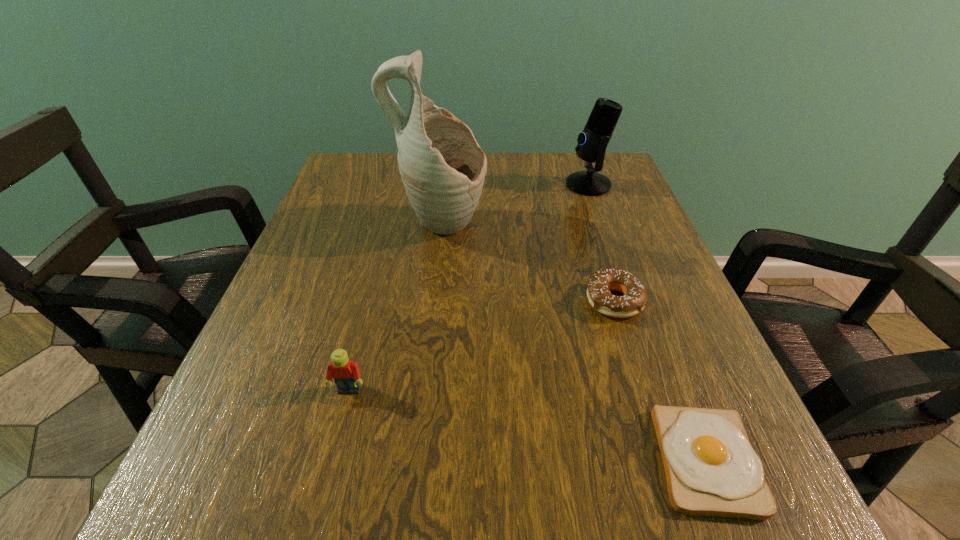
Where is `vacant area situated at the spout of the pitcher`? The height and width of the screenshot is (540, 960). vacant area situated at the spout of the pitcher is located at coordinates (626, 227).

Find the location of a particular element. The image size is (960, 540). free location located 0.390m on the stand of the fourth shortest object is located at coordinates (407, 185).

This screenshot has height=540, width=960. I want to click on free space located on the stand of the fourth shortest object, so click(411, 185).

Identify the location of free space located 0.190m on the stand of the fourth shortest object. (489, 185).

Where is `free space located 0.150m on the face of the fourth farthest object`? free space located 0.150m on the face of the fourth farthest object is located at coordinates (319, 510).

Where is `blank area located on the left of the doughnut`? The width and height of the screenshot is (960, 540). blank area located on the left of the doughnut is located at coordinates (517, 301).

Identify the location of vacant space located 0.230m on the back of the shortest object. (642, 296).

This screenshot has height=540, width=960. What are the coordinates of `object that is at the far edge` in the screenshot? It's located at (592, 142).

Locate an element on the screen. object situated at the near edge is located at coordinates (711, 469).

This screenshot has height=540, width=960. In order to click on object present at the left edge in this screenshot , I will do `click(346, 375)`.